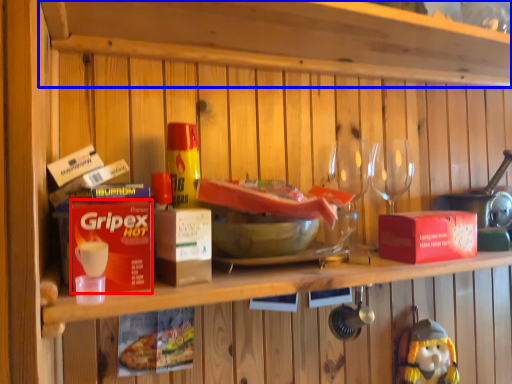
Question: Which of the following is the farthest to the observer, box (highlighted by a red box) or shelf (highlighted by a blue box)?

Choices:
 (A) box
 (B) shelf

Answer: (A)